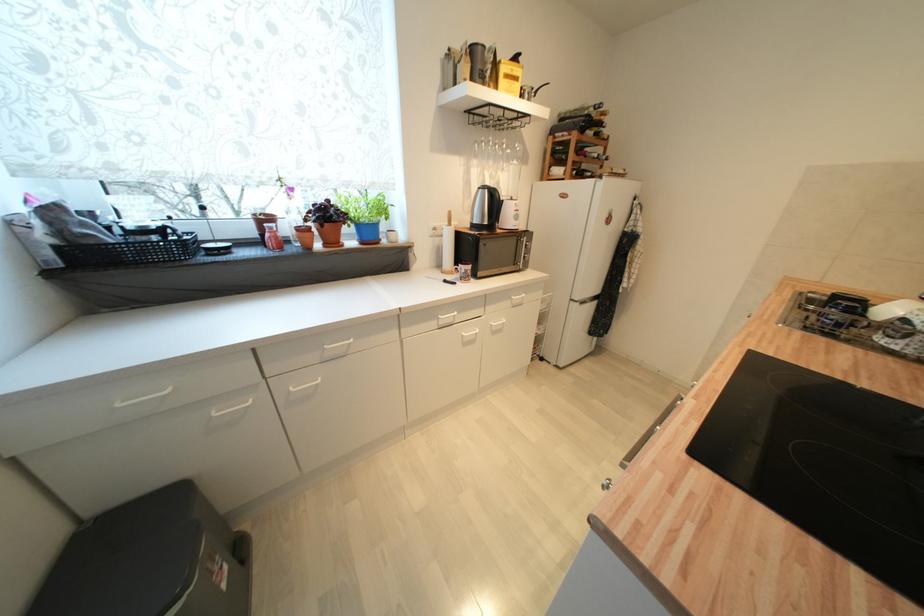
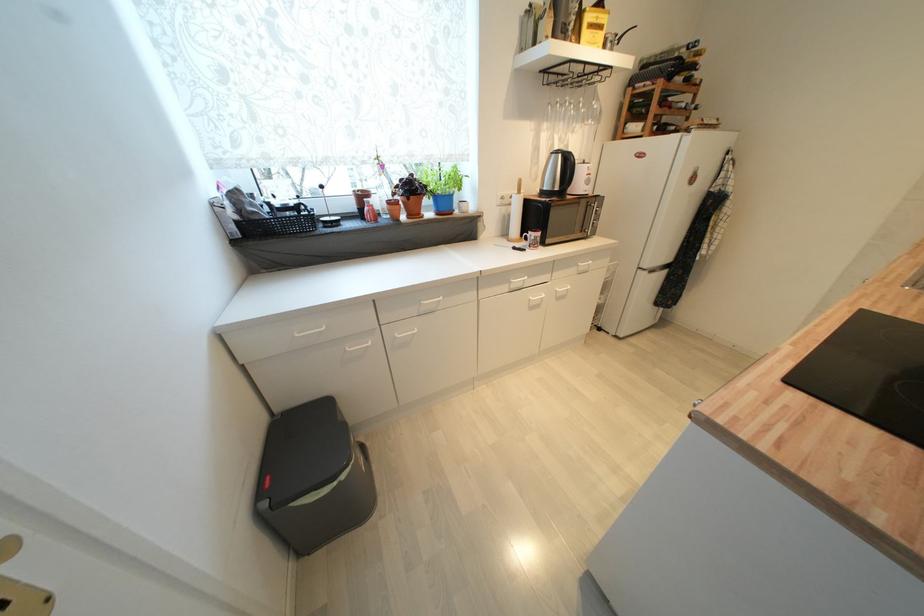
Find the pixel in the second image that matches the point at 62,251 in the first image.

(242, 225)